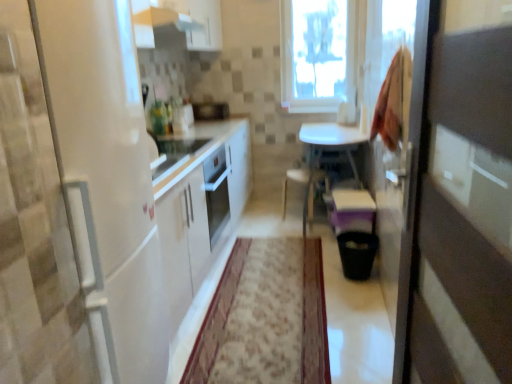
Identify the location of free space in front of wooden chair at center. (298, 238).